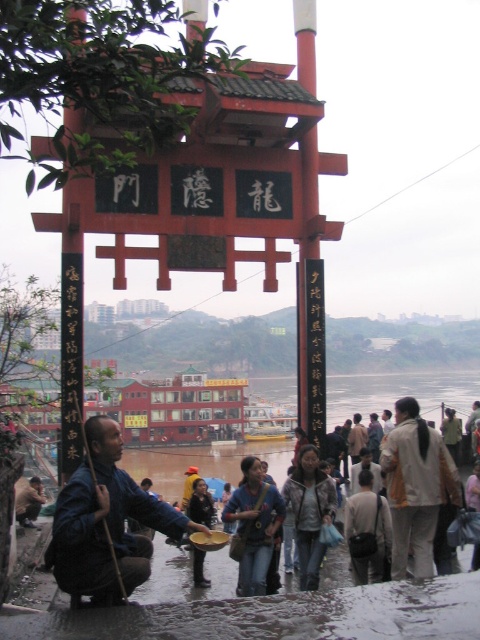
Question: Which object is farther from the camera taking this photo?

Choices:
 (A) brown leather jacket at lower left
 (B) blue fabric man at lower left

Answer: (A)

Question: Can you confirm if blue fabric man at lower left is positioned below brown leather jacket at lower left?

Choices:
 (A) no
 (B) yes

Answer: (A)

Question: Which point is closer to the camera taking this photo?

Choices:
 (A) (92, 577)
 (B) (21, 490)

Answer: (A)

Question: Is blue fabric man at lower left positioned at the back of brown leather jacket at lower left?

Choices:
 (A) no
 (B) yes

Answer: (A)

Question: Does blue fabric man at lower left appear on the right side of brown leather jacket at lower left?

Choices:
 (A) no
 (B) yes

Answer: (B)

Question: Which point is farther from the camera taking this photo?

Choices:
 (A) (28, 481)
 (B) (108, 435)
 (C) (397, 476)

Answer: (A)